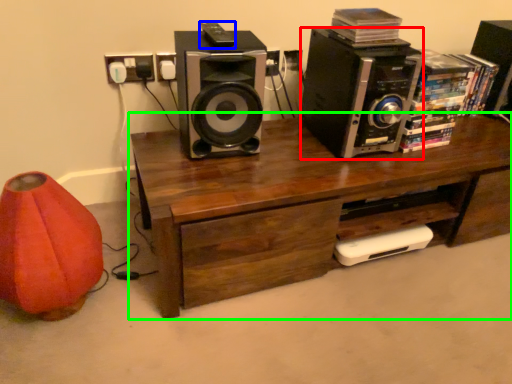
Question: Which object is positioned closest to speaker (highlighted by a red box)? Select from ipod (highlighted by a blue box) and desk (highlighted by a green box).

Choices:
 (A) ipod
 (B) desk

Answer: (B)